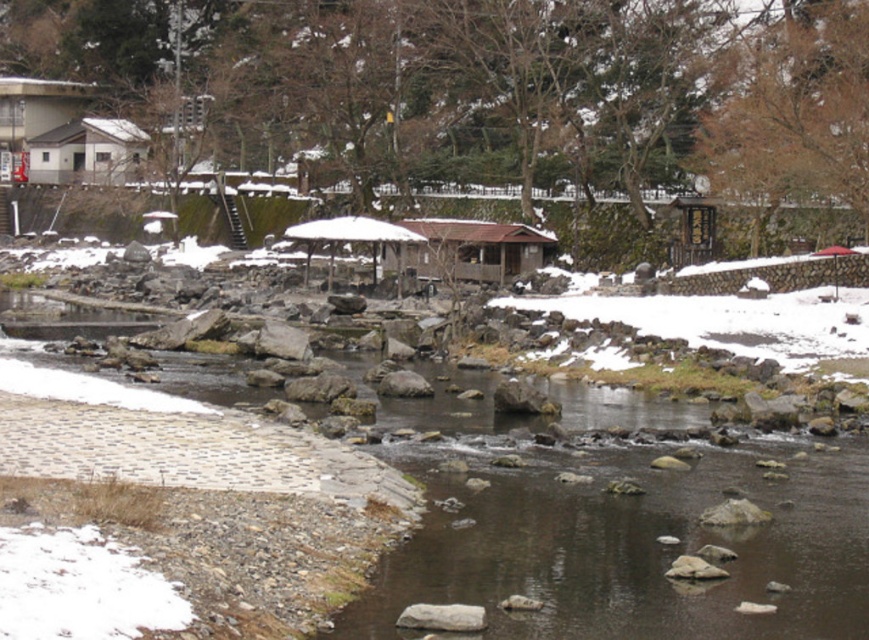
You are planning to cross the river using the stones in the riverbed. The brown wooden hut at center and the white matte umbrella at center are both visible from your current position. Which object should you use as a reference point for navigation since it is wider and easier to see from a distance?

The brown wooden hut at center should be used as the reference point because its width surpasses that of the white matte umbrella at center, making it more visible from a distance.

You are planning to set up a winter photography session and need to decide where to place your equipment. The scene includes a white matte hut at upper left and a white matte umbrella at center. Which object would provide more space to place your equipment due to its size?

The white matte hut at upper left has a larger size compared to the white matte umbrella at center, so it would provide more space to place equipment.

You are standing at the point labeled point (475, 250) in the winter scene. What is the object directly beneath your feet?

The point labeled point (475, 250) is on brown wooden hut at center, so the object directly beneath your feet is the brown wooden hut at center.